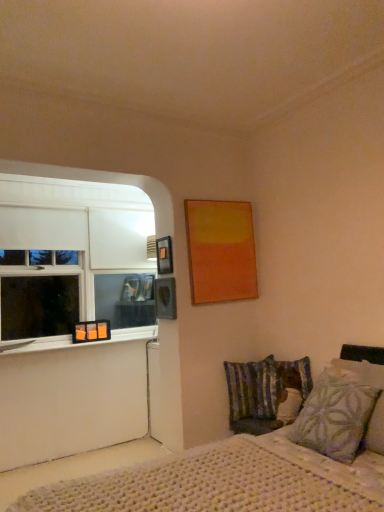
Question: From a real-world perspective, is white knitted bed at lower right over white matte window at left?

Choices:
 (A) yes
 (B) no

Answer: (B)

Question: From the image's perspective, would you say white knitted bed at lower right is shown under white matte window at left?

Choices:
 (A) no
 (B) yes

Answer: (B)

Question: Does white knitted bed at lower right have a lesser width compared to white matte window at left?

Choices:
 (A) no
 (B) yes

Answer: (A)

Question: Does white knitted bed at lower right turn towards white matte window at left?

Choices:
 (A) yes
 (B) no

Answer: (B)

Question: Does white knitted bed at lower right have a lesser height compared to white matte window at left?

Choices:
 (A) no
 (B) yes

Answer: (B)

Question: From the image's perspective, is white knitted bed at lower right located above or below matte black picture frame at upper left, acting as the second picture frame starting from the bottom?

Choices:
 (A) above
 (B) below

Answer: (B)

Question: Relative to matte black picture frame at upper left, the second picture frame viewed from the top, is white knitted bed at lower right in front or behind?

Choices:
 (A) behind
 (B) front

Answer: (B)

Question: From a real-world perspective, is white knitted bed at lower right physically located above or below matte black picture frame at upper left, positioned as the second picture frame in back-to-front order?

Choices:
 (A) below
 (B) above

Answer: (A)

Question: Looking at their shapes, would you say white knitted bed at lower right is wider or thinner than matte black picture frame at upper left, acting as the second picture frame starting from the bottom?

Choices:
 (A) thin
 (B) wide

Answer: (B)

Question: From a real-world perspective, relative to clear glass window sill at lower left, is striped fabric pillow at lower right, placed as the 1th pillow when sorted from back to front, vertically above or below?

Choices:
 (A) above
 (B) below

Answer: (B)

Question: Based on their positions, is striped fabric pillow at lower right, which is counted as the 2th pillow, starting from the front, located to the left or right of clear glass window sill at lower left?

Choices:
 (A) right
 (B) left

Answer: (A)

Question: Is striped fabric pillow at lower right, marked as the 1th pillow in a left-to-right arrangement, taller or shorter than clear glass window sill at lower left?

Choices:
 (A) tall
 (B) short

Answer: (A)

Question: Is striped fabric pillow at lower right, marked as the 1th pillow in a left-to-right arrangement, wider or thinner than clear glass window sill at lower left?

Choices:
 (A) wide
 (B) thin

Answer: (B)

Question: Considering the positions of point (139, 329) and point (145, 295), is point (139, 329) closer or farther from the camera than point (145, 295)?

Choices:
 (A) farther
 (B) closer

Answer: (B)

Question: Choose the correct answer: Is clear glass window sill at lower left inside white matte window at left or outside it?

Choices:
 (A) outside
 (B) inside

Answer: (A)